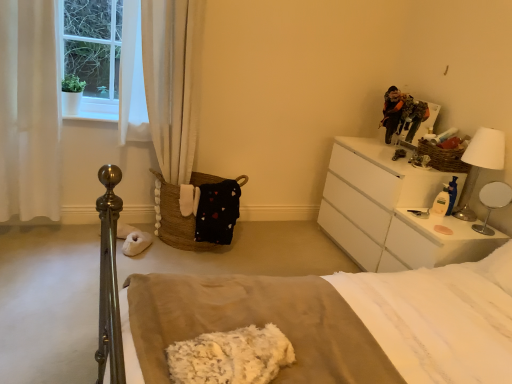
Question: Does white glossy table lamp at right, the 1th table lamp ordered from the bottom, have a greater height compared to white fluffy blanket at center?

Choices:
 (A) yes
 (B) no

Answer: (A)

Question: From the image's perspective, is white glossy table lamp at right, placed as the second table lamp when sorted from top to bottom, beneath white fluffy blanket at center?

Choices:
 (A) no
 (B) yes

Answer: (A)

Question: Is white glossy table lamp at right, the 1th table lamp ordered from the bottom, oriented towards white fluffy blanket at center?

Choices:
 (A) yes
 (B) no

Answer: (B)

Question: Is white glossy table lamp at right, placed as the second table lamp when sorted from top to bottom, positioned before white fluffy blanket at center?

Choices:
 (A) yes
 (B) no

Answer: (B)

Question: Is white glossy table lamp at right, the 1th table lamp ordered from the bottom, at the left side of white fluffy blanket at center?

Choices:
 (A) yes
 (B) no

Answer: (B)

Question: Does point (452, 148) appear closer or farther from the camera than point (387, 107)?

Choices:
 (A) farther
 (B) closer

Answer: (B)

Question: In terms of width, does woven brown basket at upper right, marked as the 2th basket in a left-to-right arrangement, look wider or thinner when compared to camouflage jacket at upper right?

Choices:
 (A) thin
 (B) wide

Answer: (B)

Question: From the image's perspective, is woven brown basket at upper right, placed as the 1th basket when sorted from right to left, above or below camouflage jacket at upper right?

Choices:
 (A) below
 (B) above

Answer: (A)

Question: In the image, is woven brown basket at upper right, which ranks as the second basket in bottom-to-top order, positioned in front of or behind camouflage jacket at upper right?

Choices:
 (A) behind
 (B) front

Answer: (B)

Question: From the image's perspective, relative to white fabric curtain at left, which is counted as the first curtain, starting from the left, is white metallic table lamp at upper right, the second table lamp ordered from the bottom, above or below?

Choices:
 (A) above
 (B) below

Answer: (B)

Question: Based on their sizes in the image, would you say white metallic table lamp at upper right, the second table lamp ordered from the bottom, is bigger or smaller than white fabric curtain at left, which is counted as the 2th curtain, starting from the right?

Choices:
 (A) small
 (B) big

Answer: (A)

Question: From a real-world perspective, relative to white fabric curtain at left, which is counted as the first curtain, starting from the left, is white metallic table lamp at upper right, the 1th table lamp when ordered from top to bottom, vertically above or below?

Choices:
 (A) below
 (B) above

Answer: (B)

Question: Visually, is white metallic table lamp at upper right, the second table lamp ordered from the bottom, positioned to the left or to the right of white fabric curtain at left, which is counted as the 2th curtain, starting from the right?

Choices:
 (A) left
 (B) right

Answer: (B)

Question: Considering their positions, is woven brown basket at upper right, marked as the 2th basket in a left-to-right arrangement, located in front of or behind beige cotton bed at center?

Choices:
 (A) behind
 (B) front

Answer: (A)

Question: Does point [x=468, y=170] appear closer or farther from the camera than point [x=166, y=279]?

Choices:
 (A) closer
 (B) farther

Answer: (B)